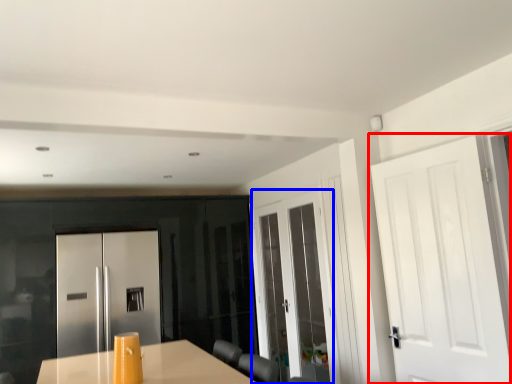
Question: Which object is further to the camera taking this photo, door (highlighted by a red box) or door (highlighted by a blue box)?

Choices:
 (A) door
 (B) door

Answer: (B)